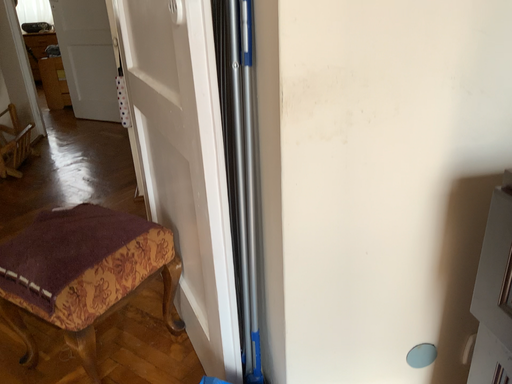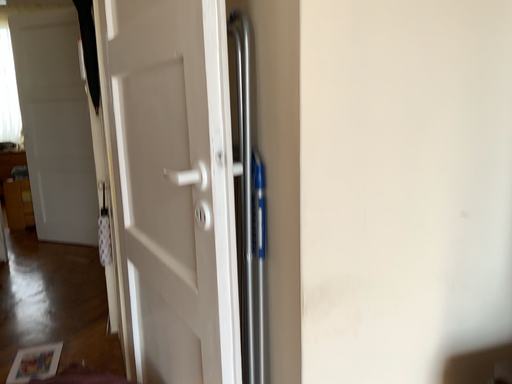
Question: Which way did the camera rotate in the video?

Choices:
 (A) rotated upward
 (B) rotated downward

Answer: (A)